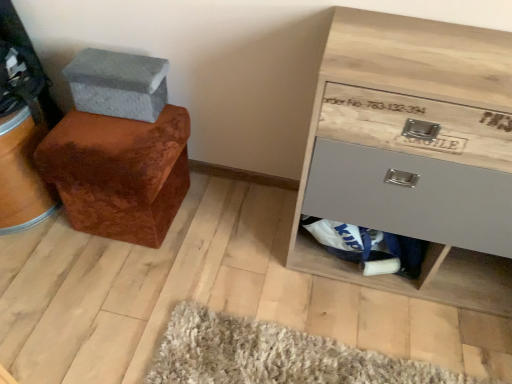
This screenshot has height=384, width=512. In order to click on vacant region to the right of matte gray drawer at lower right in this screenshot , I will do `click(451, 301)`.